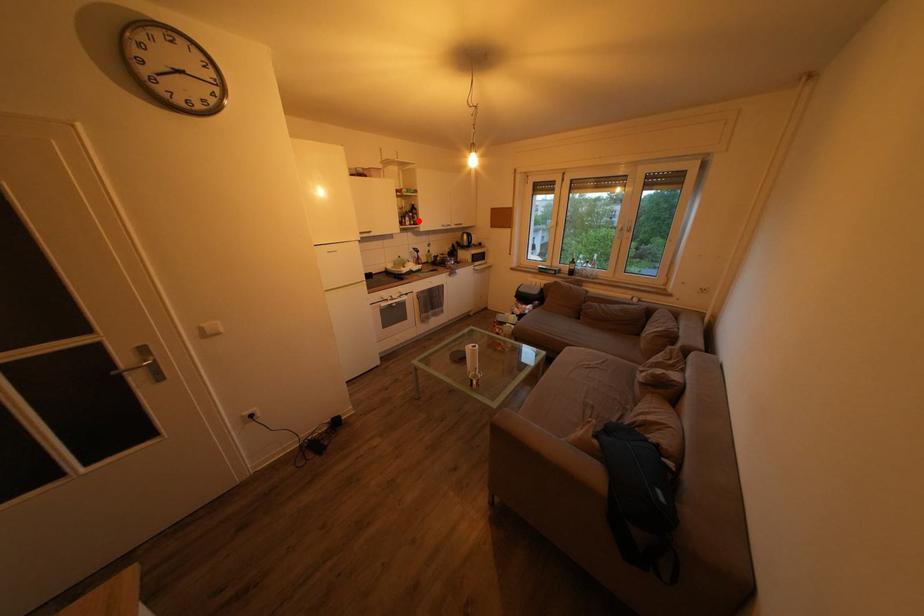
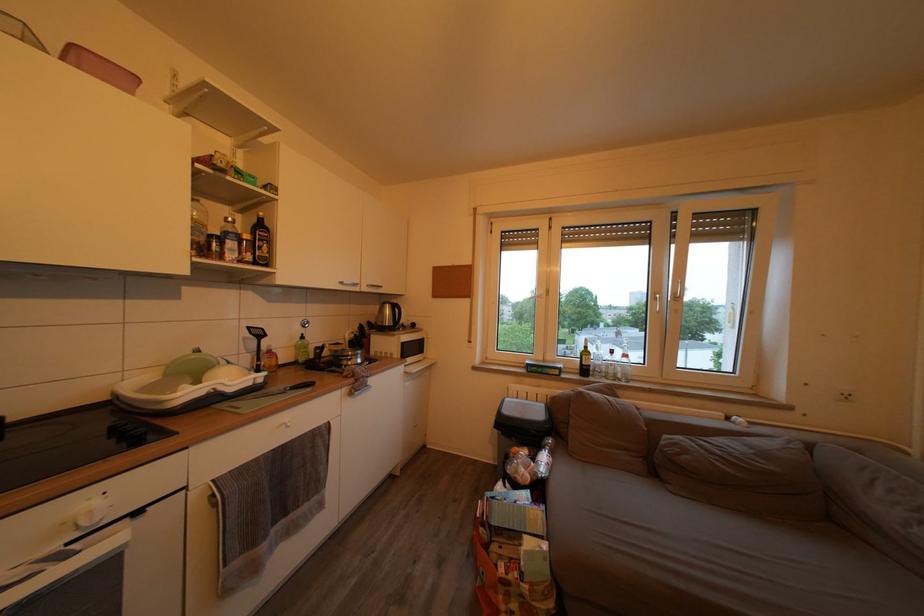
Question: I am providing you with two images of the same scene from different viewpoints. Given a red point in image1, look at the same physical point in image2. Is it:

Choices:
 (A) Closer to the viewpoint
 (B) Farther from the viewpoint

Answer: (B)